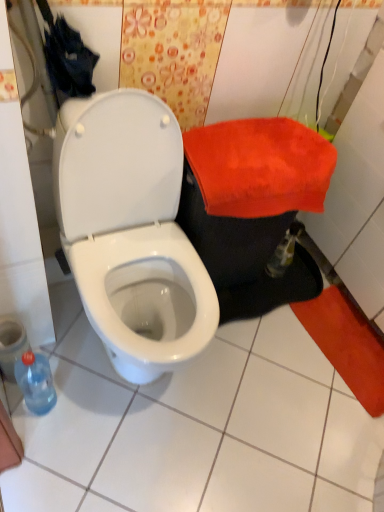
Question: In terms of height, does white glossy toilet at center look taller or shorter compared to translucent plastic bottle at lower left?

Choices:
 (A) short
 (B) tall

Answer: (B)

Question: From a real-world perspective, is white glossy toilet at center physically located above or below translucent plastic bottle at lower left?

Choices:
 (A) above
 (B) below

Answer: (A)

Question: Which of these objects is positioned farthest from the white glossy toilet at center?

Choices:
 (A) red plush towel at right
 (B) translucent plastic bottle at lower left

Answer: (B)

Question: Estimate the real-world distances between objects in this image. Which object is closer to the translucent plastic bottle at lower left?

Choices:
 (A) red plush towel at right
 (B) white glossy toilet at center

Answer: (B)